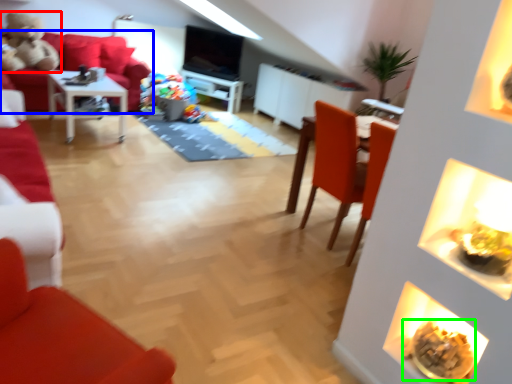
Question: Which is nearer to the toy (highlighted by a red box)? studio couch (highlighted by a blue box) or food (highlighted by a green box).

Choices:
 (A) studio couch
 (B) food

Answer: (A)